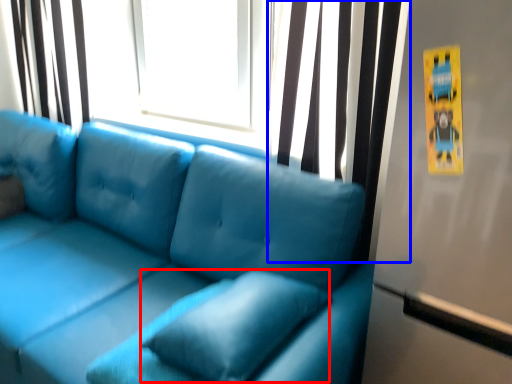
Question: Which of the following is the farthest to the observer, pillow (highlighted by a red box) or curtain (highlighted by a blue box)?

Choices:
 (A) pillow
 (B) curtain

Answer: (B)